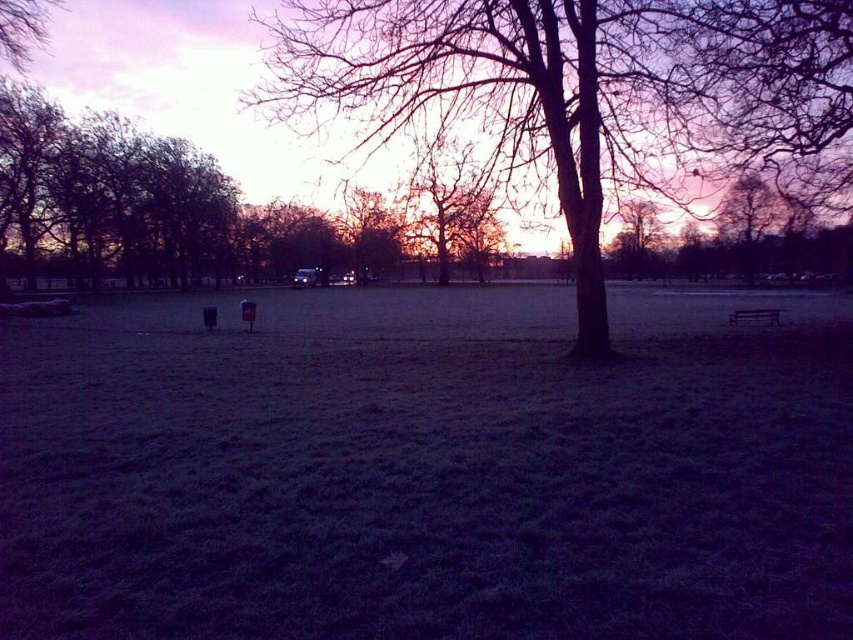
Can you confirm if brown/dry bark tree at center is positioned above smooth bark tree at center?

Incorrect, brown/dry bark tree at center is not positioned above smooth bark tree at center.

Which is below, brown/dry bark tree at center or smooth bark tree at center?

brown/dry bark tree at center is lower down.

Is point (635, 29) positioned before point (431, 161)?

Yes, it is in front of point (431, 161).

This screenshot has width=853, height=640. In order to click on brown/dry bark tree at center in this screenshot , I will do `click(590, 92)`.